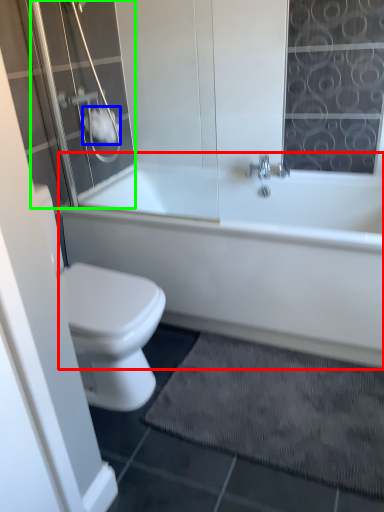
Question: Which is farther away from bathtub (highlighted by a red box)? toilet paper (highlighted by a blue box) or shower door (highlighted by a green box)?

Choices:
 (A) toilet paper
 (B) shower door

Answer: (A)